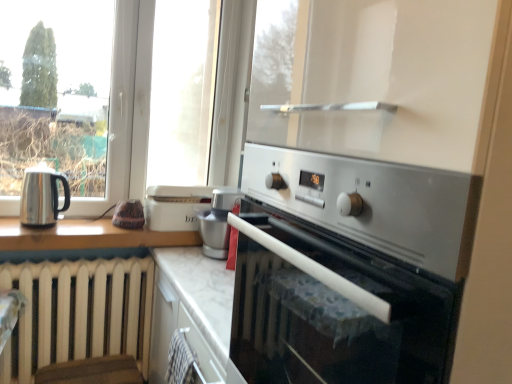
Question: From a real-world perspective, is satin silver appliance at center physically located above or below shiny metallic kettle at left?

Choices:
 (A) above
 (B) below

Answer: (B)

Question: In terms of height, does satin silver appliance at center look taller or shorter compared to shiny metallic kettle at left?

Choices:
 (A) tall
 (B) short

Answer: (A)

Question: Estimate the real-world distances between objects in this image. Which object is closer to the shiny metallic kettle at left?

Choices:
 (A) satin silver oven at center
 (B) satin silver appliance at center

Answer: (B)

Question: Which object is positioned closest to the shiny metallic kettle at left?

Choices:
 (A) satin silver oven at center
 (B) satin silver appliance at center

Answer: (B)